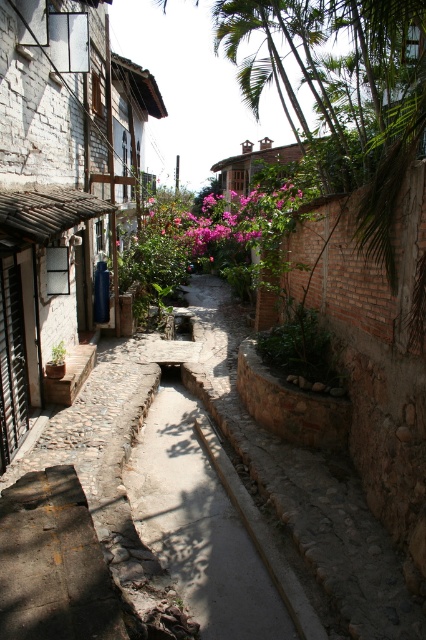
You are standing in the middle of the alleyway and want to take a photo. There are two points of interest marked as point 1 at coordinates (293, 188) and point 2 at coordinates (60, 349). Which point will appear closer to the camera in your photo?

Point 2 at coordinates (60, 349) will appear closer to the camera in your photo because it is closer to the viewer than point 1 at coordinates (293, 188).

You are a delivery drone with a wingspan of 0.9 meters. You need to fly through the narrow alleyway between the pink matte flowers at center and the green leafy plant at center. Can your drone safely pass through the space between them without touching either?

The distance between the pink matte flowers at center and the green leafy plant at center is 9.15 meters. Since your drone has a wingspan of 0.9 meters, it can safely pass through the space between them as the distance is more than sufficient to accommodate the drone without any contact.